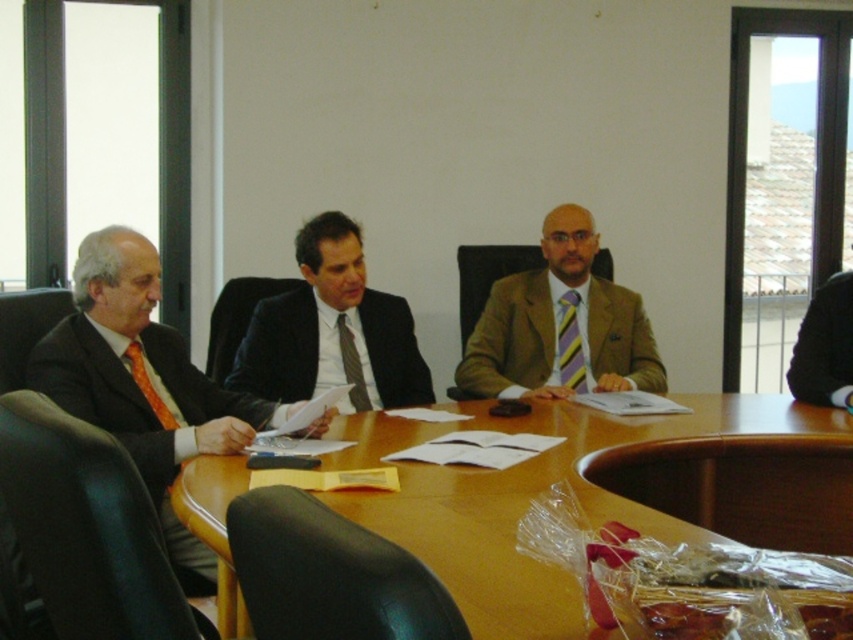
This screenshot has width=853, height=640. Describe the element at coordinates (134, 381) in the screenshot. I see `matte black suit at left` at that location.

Between matte black suit at left and matte black suit at center, which one is positioned higher?

matte black suit at center is higher up.

Where is `matte black suit at left`? This screenshot has width=853, height=640. matte black suit at left is located at coordinates (134, 381).

The width and height of the screenshot is (853, 640). I want to click on matte black suit at left, so click(134, 381).

Which is in front, point (219, 454) or point (347, 369)?

Point (219, 454) is more forward.

The height and width of the screenshot is (640, 853). Find the location of `matte black suit at left`. matte black suit at left is located at coordinates 134,381.

Is matte black suit at center to the right of yellow striped tie at center from the viewer's perspective?

Incorrect, matte black suit at center is not on the right side of yellow striped tie at center.

Is point (358, 328) more distant than point (569, 358)?

No, it is not.

Image resolution: width=853 pixels, height=640 pixels. What do you see at coordinates (332, 330) in the screenshot?
I see `matte black suit at center` at bounding box center [332, 330].

At what (x,y) coordinates should I click in order to perform the action: click on matte black suit at center. Please return your answer as a coordinate pair (x, y). Looking at the image, I should click on (332, 330).